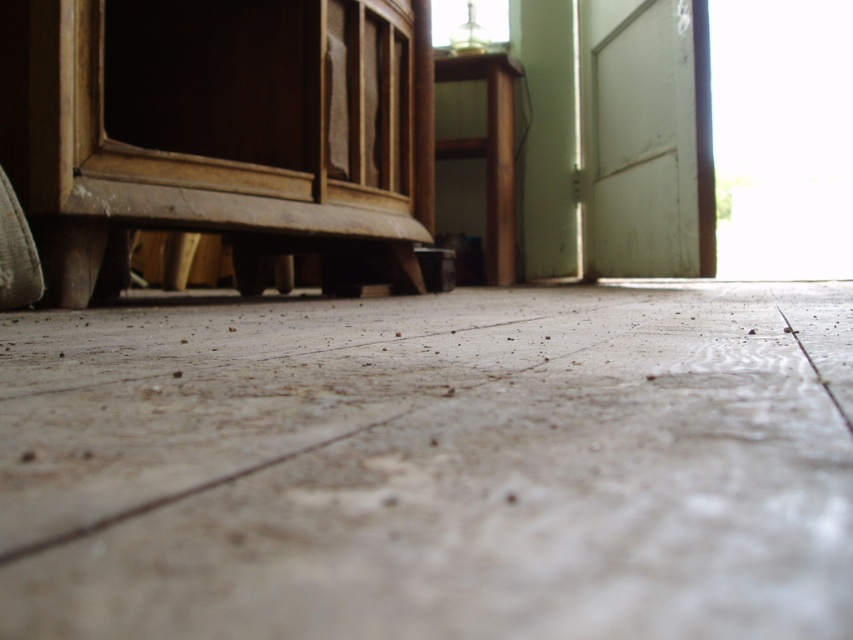
Which is above, wooden dresser at left or wooden stool at center?

wooden stool at center is above.

Who is lower down, wooden dresser at left or wooden stool at center?

Positioned lower is wooden dresser at left.

Measure the distance between point (332,132) and camera.

Point (332,132) and camera are 8.72 feet apart.

You are a GUI agent. You are given a task and a screenshot of the screen. Output one action in this format:
    pyautogui.click(x=<x>, y=<y>)
    Task: Click on the wooden dresser at left
    
    Given the screenshot: What is the action you would take?
    pyautogui.click(x=221, y=132)